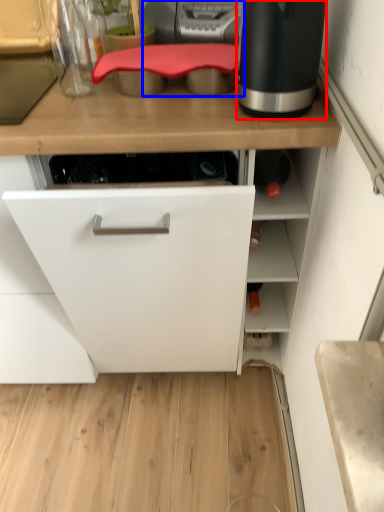
Question: Which point is further to the camera, home appliance (highlighted by a red box) or kitchen appliance (highlighted by a blue box)?

Choices:
 (A) home appliance
 (B) kitchen appliance

Answer: (B)